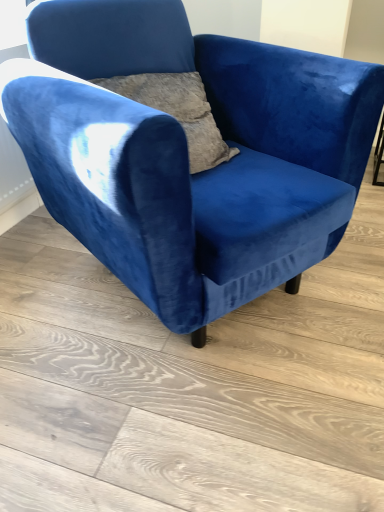
In order to face velvet blue armchair at center, should I rotate leftwards or rightwards?

To face it directly, rotate left by 0.088 degrees.

Locate an element on the screen. The image size is (384, 512). velvet blue armchair at center is located at coordinates (228, 80).

What do you see at coordinates (228, 80) in the screenshot?
I see `velvet blue armchair at center` at bounding box center [228, 80].

Where is `velvet blue armchair at center`? The image size is (384, 512). velvet blue armchair at center is located at coordinates (x=228, y=80).